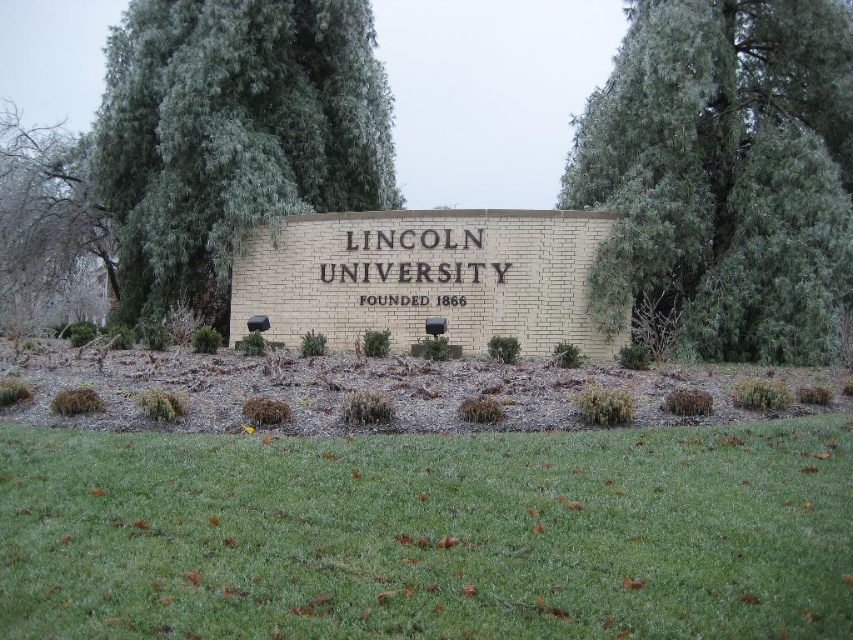
Who is more forward, [363,173] or [55,291]?

Positioned in front is point [363,173].

Can you confirm if green leafy tree at upper left is bigger than green leafy tree at left?

No, green leafy tree at upper left is not bigger than green leafy tree at left.

What are the coordinates of `green leafy tree at upper left` in the screenshot? It's located at (231, 134).

Is green grass at lower center above green leafy tree at left?

No.

Is green grass at lower center thinner than green leafy tree at left?

Indeed, green grass at lower center has a lesser width compared to green leafy tree at left.

This screenshot has height=640, width=853. I want to click on green grass at lower center, so click(x=428, y=534).

Who is higher up, green needle-like leaves at upper center or green leafy tree at upper left?

green leafy tree at upper left

Is green needle-like leaves at upper center positioned in front of green leafy tree at upper left?

Yes, green needle-like leaves at upper center is in front of green leafy tree at upper left.

Who is more distant from viewer, (700, 244) or (126, 112)?

Point (126, 112)

Where is `green needle-like leaves at upper center`? green needle-like leaves at upper center is located at coordinates (724, 172).